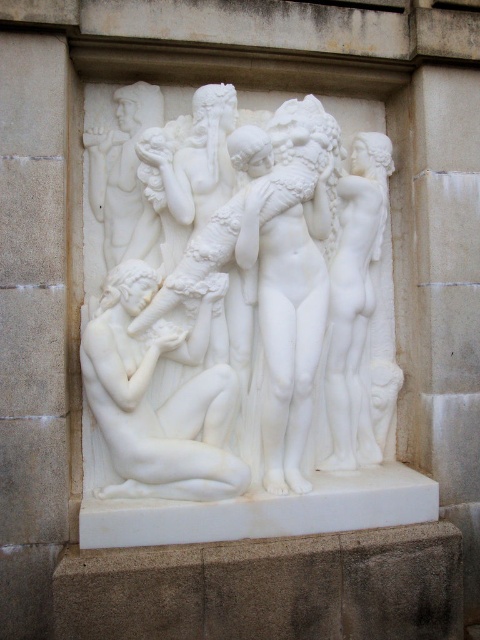
You are an art student analyzing the marble relief sculpture. You notice two figures at the center of the scene. One is labeled as the white marble sculpture at center and the other as the white marble nude at center. Based on their positions, which figure is positioned higher up in the relief?

The white marble sculpture at center is taller than the white marble nude at center, so the white marble sculpture at center is positioned higher up in the relief.